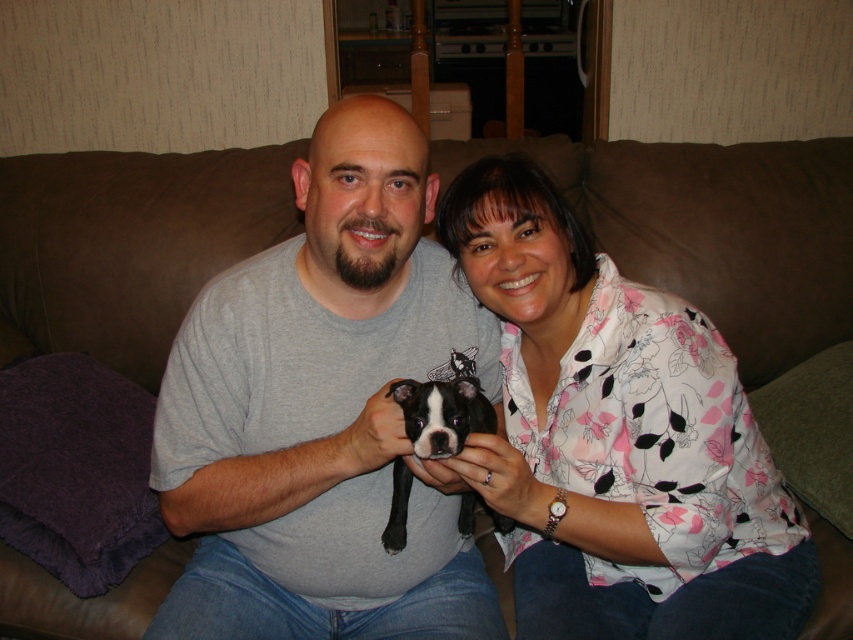
You are standing in front of the couch where the man and woman are sitting with the puppy. You want to place a small gift on the couch between them. The gift needs to be placed at a position that is closer to the man than to the woman. Which coordinate point should you choose, point A at [345,397] or point B at [231,548]?

Point A at [345,397] is closer to the man than point B at [231,548] because it is in front of point B, which is closer to the woman.

Based on the scene description, which object is positioned lower between the jeans at center and the black fur dog at center?

The jeans at center is positioned lower than the black fur dog at center.

You are standing in front of the couch and want to hand a treat to the black fur dog at center. To reach the dog, should you move to the left or right side of the jeans at center?

The jeans at center are to the left of the black fur dog at center, so to reach the dog, you should move to the right side of the jeans at center.